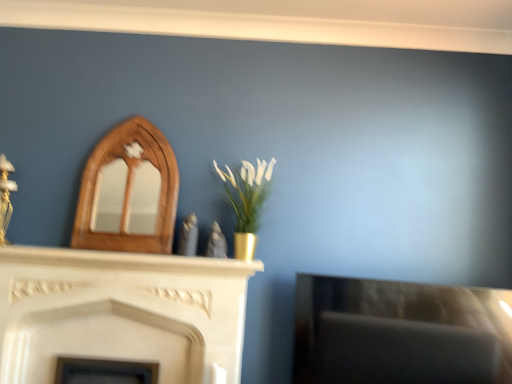
Find the location of a particular element. The image size is (512, 384). free region under wooden mirror at upper left, placed as the 2th fireplace when sorted from bottom to top (from a real-world perspective) is located at coordinates (126, 246).